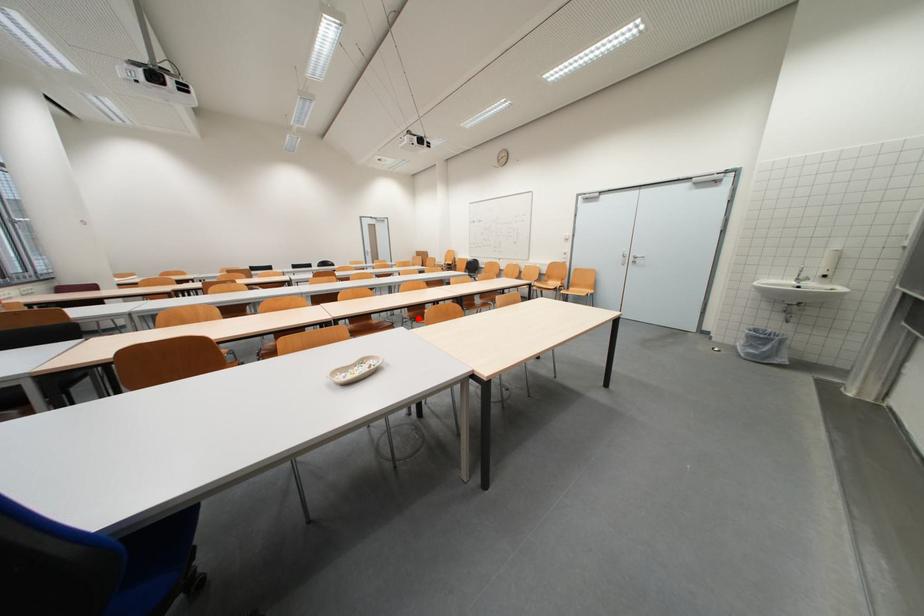
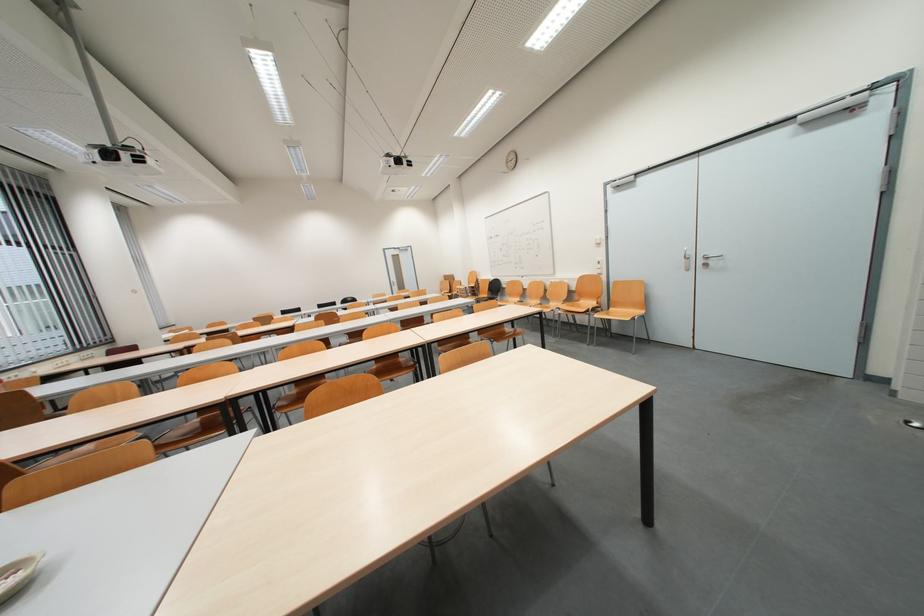
Question: I am providing you with two images of the same scene from different viewpoints. Given a red point in image1, look at the same physical point in image2. Is it:

Choices:
 (A) Closer to the viewpoint
 (B) Farther from the viewpoint

Answer: (A)